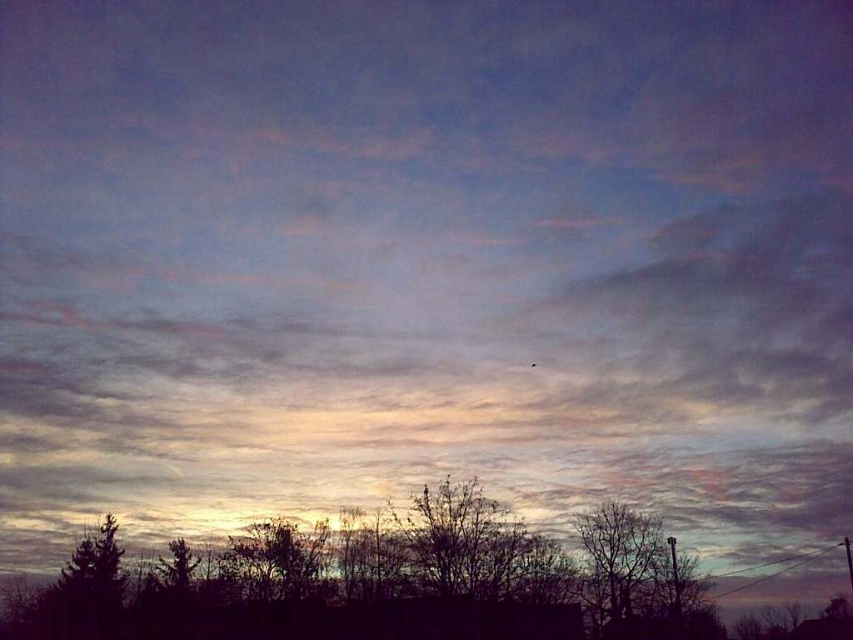
Question: Which point appears farthest from the camera in this image?

Choices:
 (A) (642, 624)
 (B) (560, 616)

Answer: (B)

Question: Where is silhouette leafless tree at lower center located in relation to dark brown bark tree at lower right in the image?

Choices:
 (A) right
 (B) left

Answer: (B)

Question: Is silhouette leafless tree at lower center thinner than dark brown bark tree at lower right?

Choices:
 (A) yes
 (B) no

Answer: (B)

Question: Is silhouette leafless tree at lower center to the right of dark brown bark tree at lower right from the viewer's perspective?

Choices:
 (A) yes
 (B) no

Answer: (B)

Question: Which point is closer to the camera?

Choices:
 (A) dark brown bark tree at lower right
 (B) silhouette leafless tree at lower center

Answer: (A)